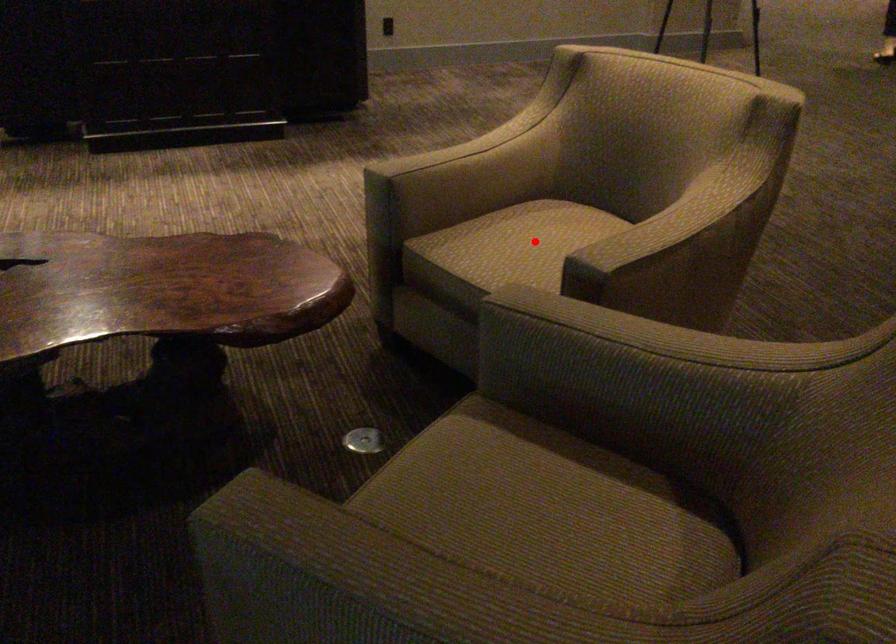
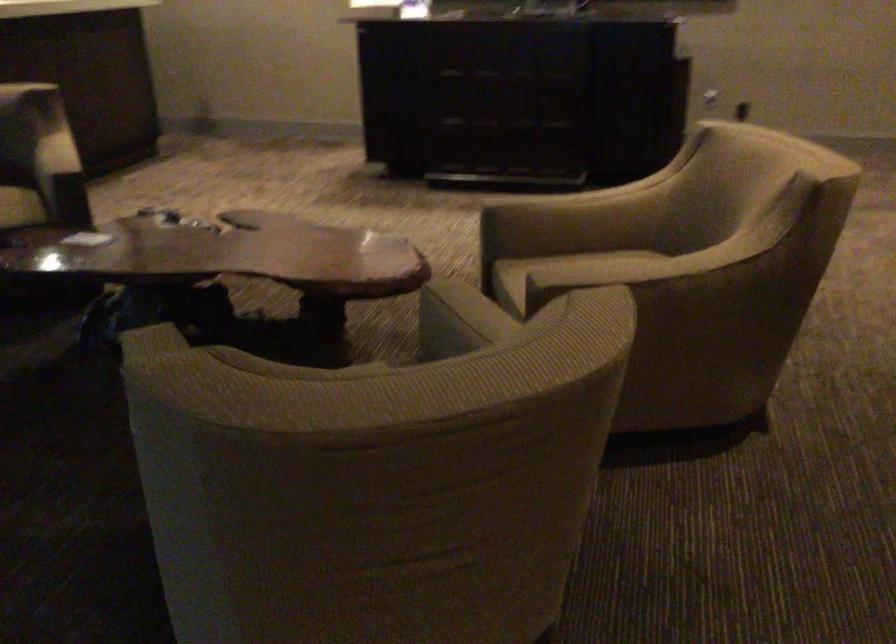
Question: I am providing you with two images of the same scene from different viewpoints. A red point is marked on the first image. Can you still see the location of the red point in image 2?

Choices:
 (A) Yes
 (B) No

Answer: (B)